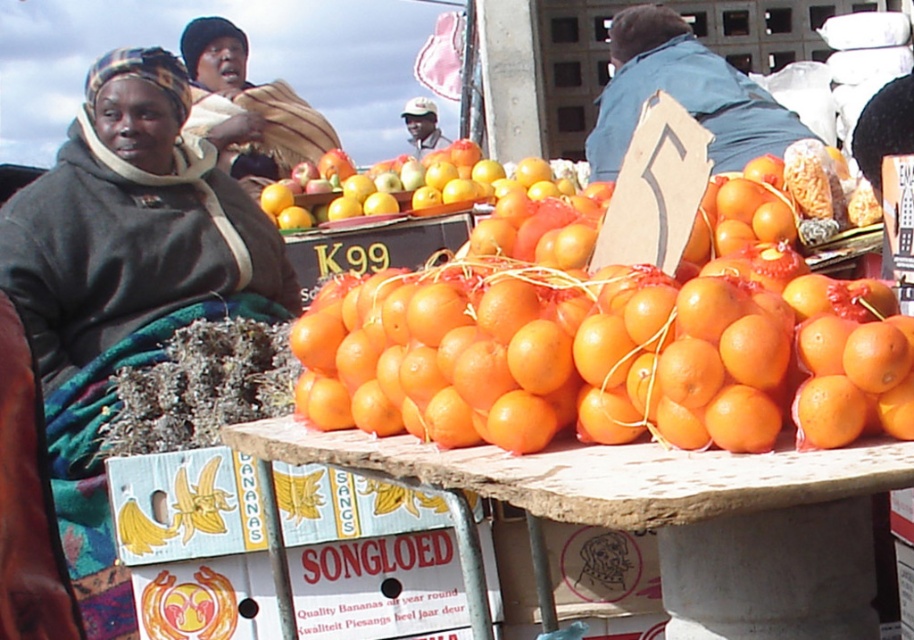
You are a customer at the market and want to buy a matte black jacket at left. The vendor tells you that the jacket is located at coordinates point (125, 282). Can you confirm if this point is on the left side of the stall?

Yes, the point (125, 282) marks the matte black jacket at left, so it is located on the left side of the stall.

You are a customer at the market and want to buy the orange matte at center. You notice a blue denim jacket at upper center hanging nearby. Which item takes up more horizontal space?

The blue denim jacket at upper center takes up more horizontal space because its width is greater than the orange matte at center.

You are a customer at the market holding a shopping basket. You want to pick up the orange matte at center and then the blue denim jacket at upper center. Can you reach both items without moving your basket? Please explain.

The orange matte at center and blue denim jacket at upper center are 3.41 meters apart. Since the distance between them is quite large, you would likely need to move your basket to reach both items.